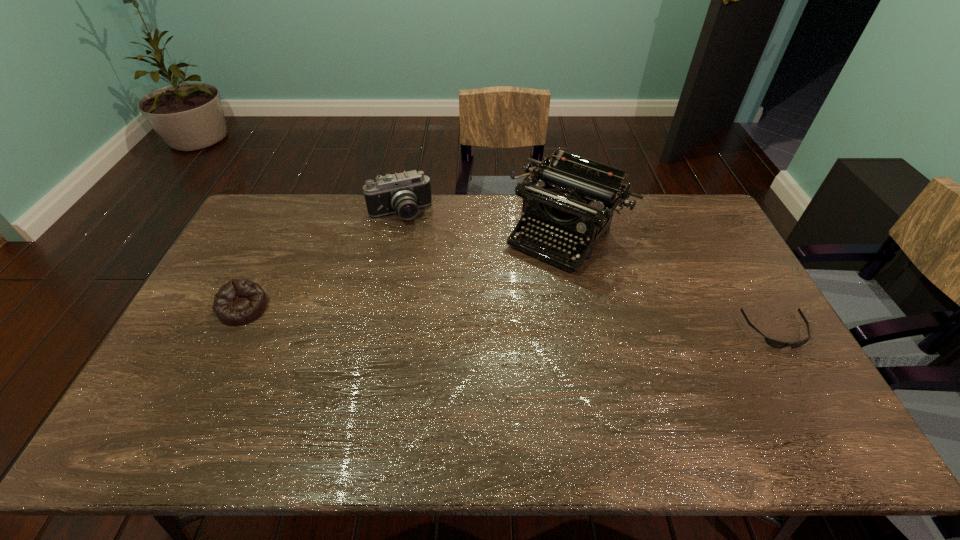
You are a GUI agent. You are given a task and a screenshot of the screen. Output one action in this format:
    pyautogui.click(x=<x>, y=<y>)
    Task: Click on the third tallest object
    The image size is (960, 540).
    Given the screenshot: What is the action you would take?
    pyautogui.click(x=239, y=301)

At what (x,y) coordinates should I click in order to perform the action: click on the leftmost object. Please return your answer as a coordinate pair (x, y). This screenshot has height=540, width=960. Looking at the image, I should click on (239, 301).

At what (x,y) coordinates should I click in order to perform the action: click on sunglasses. Please return your answer as a coordinate pair (x, y). Looking at the image, I should click on (777, 344).

Locate an element on the screen. The width and height of the screenshot is (960, 540). the shortest object is located at coordinates (777, 344).

Locate an element on the screen. This screenshot has width=960, height=540. the tallest object is located at coordinates (577, 197).

Find the location of `typewriter`. typewriter is located at coordinates (577, 197).

Identify the location of the second tallest object. (403, 193).

This screenshot has height=540, width=960. What are the coordinates of `the second object from left to right` in the screenshot? It's located at (403, 193).

Locate an element on the screen. free location located 0.130m on the right of the third tallest object is located at coordinates (311, 308).

Locate an element on the screen. The image size is (960, 540). free space located on the front-facing side of the sunglasses is located at coordinates (796, 365).